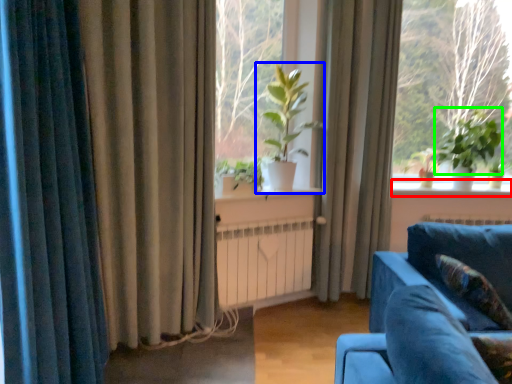
Question: Based on their relative distances, which object is farther from window sill (highlighted by a red box)? Choose from houseplant (highlighted by a blue box) and plant (highlighted by a green box).

Choices:
 (A) houseplant
 (B) plant

Answer: (A)